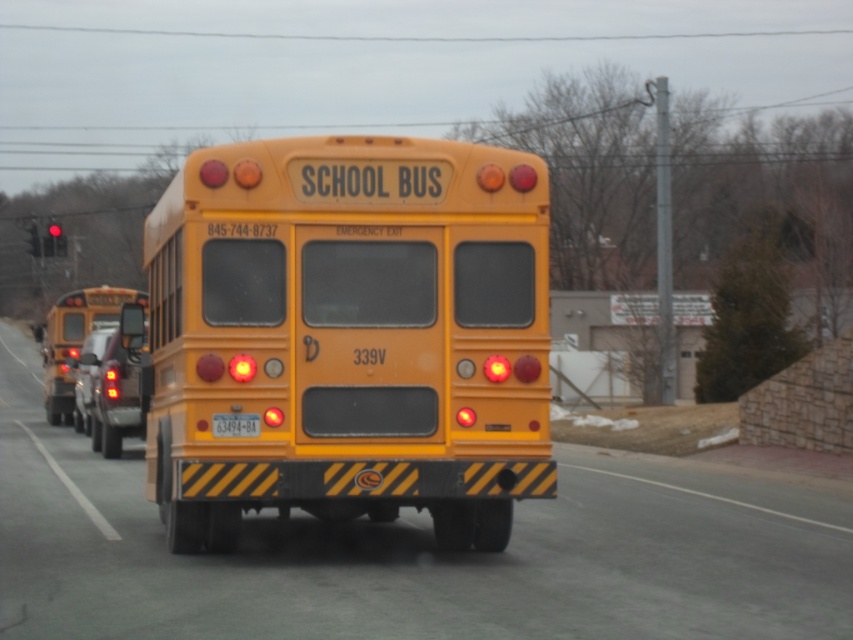
Question: Which of the following is the closest to the observer?

Choices:
 (A) pos(57,234)
 (B) pos(96,449)
 (C) pos(62,388)
 (D) pos(393,481)

Answer: (D)

Question: Does matte black car at center appear over red glass traffic light at upper left?

Choices:
 (A) no
 (B) yes

Answer: (A)

Question: Can you confirm if yellow matte/solid school bus at center is positioned above yellow matte school bus at rear?

Choices:
 (A) yes
 (B) no

Answer: (A)

Question: Which point is closer to the camera?

Choices:
 (A) yellow matte license plate at center
 (B) shiny silver car at rear left
 (C) matte black car at center

Answer: (A)

Question: Considering the relative positions of yellow matte school bus at rear and shiny silver car at rear left in the image provided, where is yellow matte school bus at rear located with respect to shiny silver car at rear left?

Choices:
 (A) below
 (B) above

Answer: (B)

Question: Which point is farther from the camera taking this photo?

Choices:
 (A) (84, 323)
 (B) (245, 424)
 (C) (50, 253)
 (D) (383, 246)

Answer: (C)